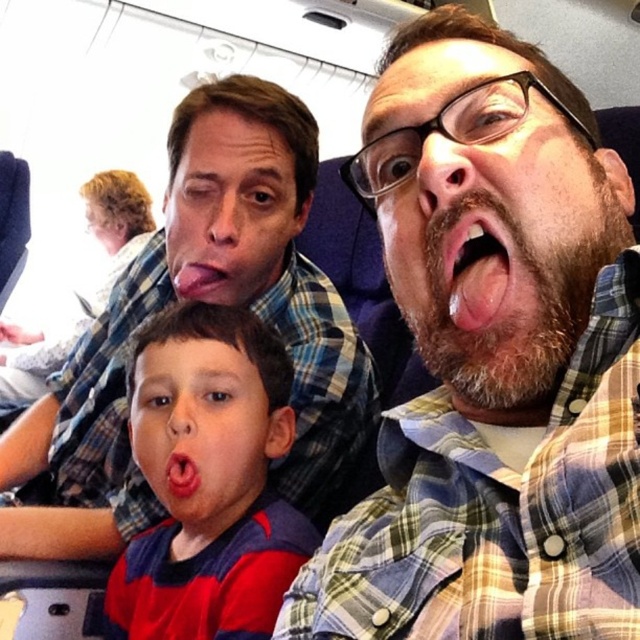
You are a flight attendant checking seat spacing. The airline requires at least 10 inches between passengers for safety. Are the passengers wearing the matte plaid shirt at upper center and the red plaid shirt at center compliant with this requirement?

The matte plaid shirt at upper center is 9.13 inches from the red plaid shirt at center. Since 9.13 inches is less than the required 10 inches, they are not compliant with the safety requirement.

You are an airplane passenger seated in the cabin. You notice a point at coordinates (205, 301). What object is located at that point?

The point at coordinates (205, 301) indicates the matte plaid shirt at upper center.

From the picture: You are an airplane seat designer who needs to ensure that the seat width accommodates passengers comfortably. Given that the plaid shirt at center and pink glossy tongue at center are both visible in the image, which object occupies more horizontal space in the image?

The plaid shirt at center occupies more horizontal space than the pink glossy tongue at center because the plaid shirt at center is wider than the pink glossy tongue at center according to the description.